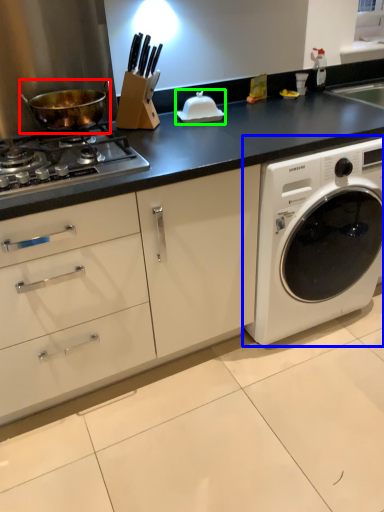
Question: Estimate the real-world distances between objects in this image. Which object is closer to wok (highlighted by a red box), washing machine (highlighted by a blue box) or appliance (highlighted by a green box)?

Choices:
 (A) washing machine
 (B) appliance

Answer: (B)